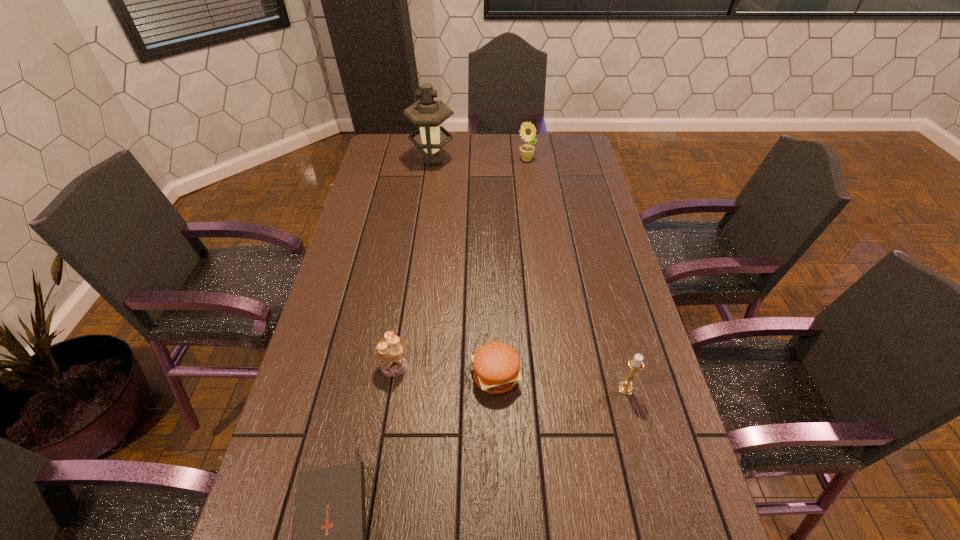
This screenshot has height=540, width=960. I want to click on free region at the far right corner of the desktop, so click(562, 142).

I want to click on empty space between the farther candle holder and the oil lamp, so click(x=414, y=263).

Identify the location of empty space that is in between the sunflower and the oil lamp. This screenshot has width=960, height=540. (479, 161).

Where is `free spot between the left candle holder and the sunflower`? free spot between the left candle holder and the sunflower is located at coordinates (460, 262).

Find the location of a particular element. The image size is (960, 540). free area in between the rightmost object and the tallest object is located at coordinates (529, 275).

Locate an element on the screen. This screenshot has width=960, height=540. free spot between the tallest object and the left candle holder is located at coordinates (414, 263).

At what (x,y) coordinates should I click in order to perform the action: click on free space between the oil lamp and the right candle holder. Please return your answer as a coordinate pair (x, y). Looking at the image, I should click on (529, 275).

In order to click on vacant area that lies between the left candle holder and the oil lamp in this screenshot , I will do `click(414, 263)`.

Identify the location of free spot between the fourth object from left to right and the farther candle holder. (445, 370).

Where is `the fifth closest object relative to the sunflower`? The image size is (960, 540). the fifth closest object relative to the sunflower is located at coordinates (329, 539).